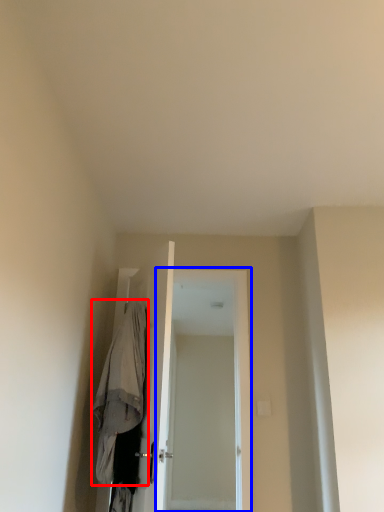
Question: Among these objects, which one is nearest to the camera, robe (highlighted by a red box) or screen door (highlighted by a blue box)?

Choices:
 (A) robe
 (B) screen door

Answer: (A)